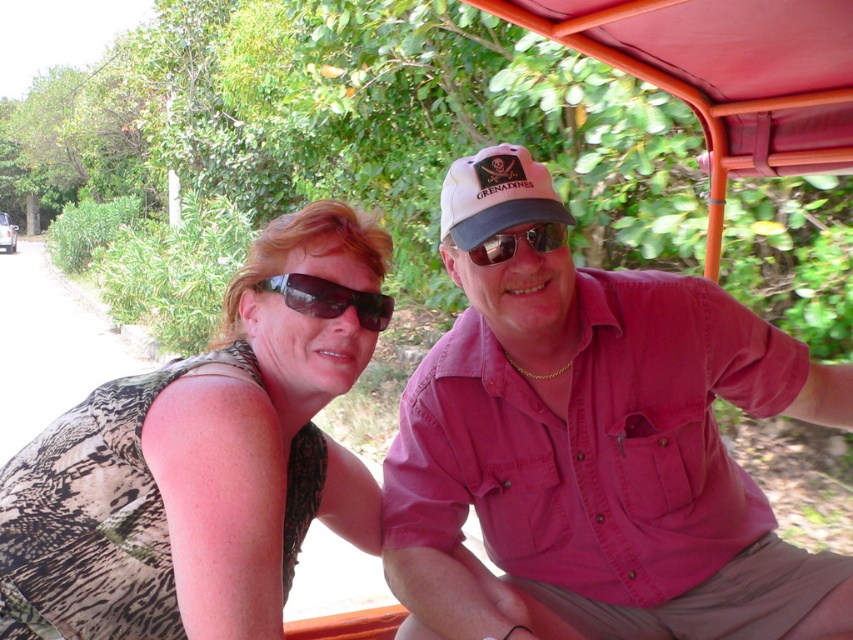
Does printed fabric tank top at left have a larger size compared to sunglasses at center?

Correct, printed fabric tank top at left is larger in size than sunglasses at center.

Which is more to the left, printed fabric tank top at left or sunglasses at center?

printed fabric tank top at left

Is point (167, 394) farther from viewer compared to point (560, 228)?

No, it is in front of (560, 228).

Where is `printed fabric tank top at left`? Image resolution: width=853 pixels, height=640 pixels. printed fabric tank top at left is located at coordinates (206, 458).

Is point (535, 429) in front of point (207, 561)?

No, (535, 429) is further to viewer.

Does pink cotton shirt at center lie behind printed fabric tank top at left?

Yes, pink cotton shirt at center is further from the viewer.

This screenshot has width=853, height=640. Describe the element at coordinates (595, 444) in the screenshot. I see `pink cotton shirt at center` at that location.

At what (x,y) coordinates should I click in order to perform the action: click on pink cotton shirt at center. Please return your answer as a coordinate pair (x, y). The image size is (853, 640). Looking at the image, I should click on (595, 444).

Can you confirm if black fabric baseball cap at center is smaller than sunglasses at center?

No.

What do you see at coordinates (496, 195) in the screenshot? Image resolution: width=853 pixels, height=640 pixels. I see `black fabric baseball cap at center` at bounding box center [496, 195].

The height and width of the screenshot is (640, 853). What are the coordinates of `black fabric baseball cap at center` in the screenshot? It's located at (496, 195).